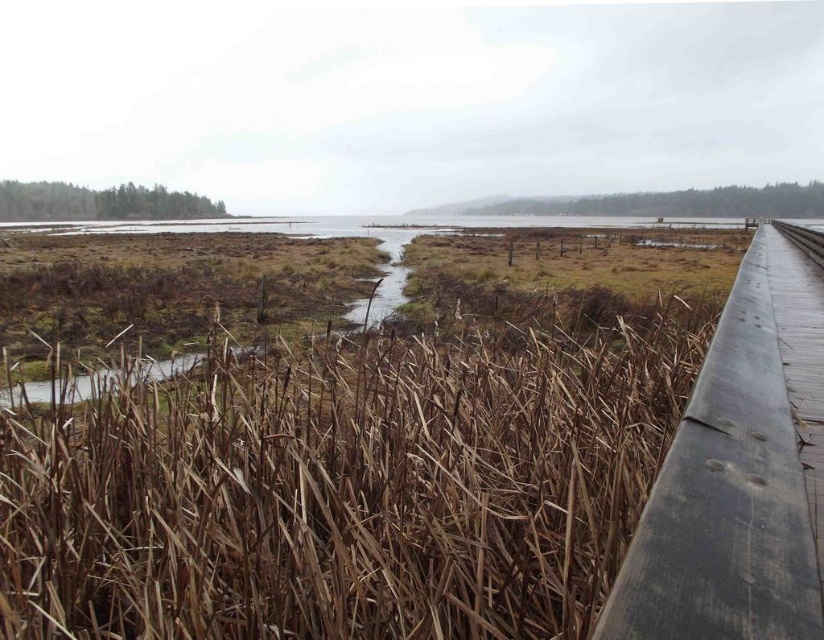
Question: Estimate the real-world distances between objects in this image. Which object is farther from the wooden at right?

Choices:
 (A) wooden rail at right
 (B) brown dry reed at lower right

Answer: (B)

Question: Does brown dry reed at lower right lie in front of wooden rail at right?

Choices:
 (A) no
 (B) yes

Answer: (A)

Question: Based on their relative distances, which object is farther from the wooden at right?

Choices:
 (A) brown dry reed at lower right
 (B) wooden rail at right

Answer: (A)

Question: Which point is farther to the camera?

Choices:
 (A) brown dry reed at lower right
 (B) wooden rail at right
 (C) wooden at right

Answer: (C)

Question: Does brown dry reed at lower right lie behind wooden rail at right?

Choices:
 (A) yes
 (B) no

Answer: (A)

Question: Is wooden rail at right further to camera compared to wooden at right?

Choices:
 (A) yes
 (B) no

Answer: (B)